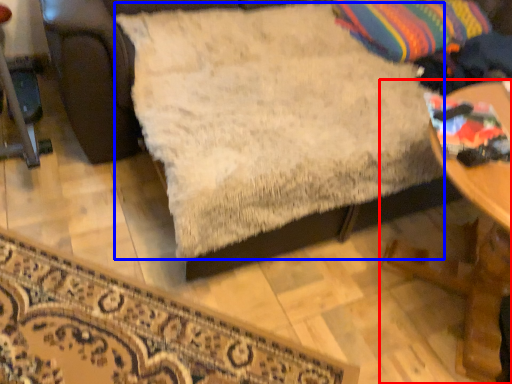
Question: Which object appears farthest to the camera in this image, table (highlighted by a red box) or sheet (highlighted by a blue box)?

Choices:
 (A) table
 (B) sheet

Answer: (A)